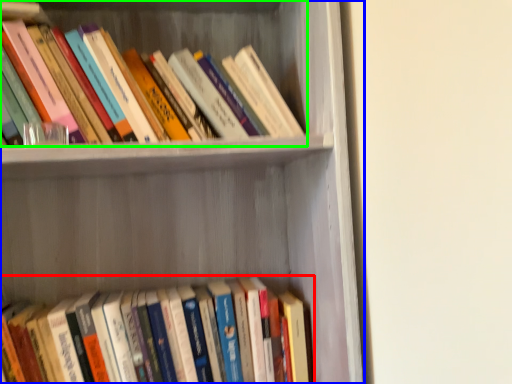
Question: Based on their relative distances, which object is farther from book (highlighted by a red box)? Choose from shelf (highlighted by a blue box) and book (highlighted by a green box).

Choices:
 (A) shelf
 (B) book

Answer: (B)